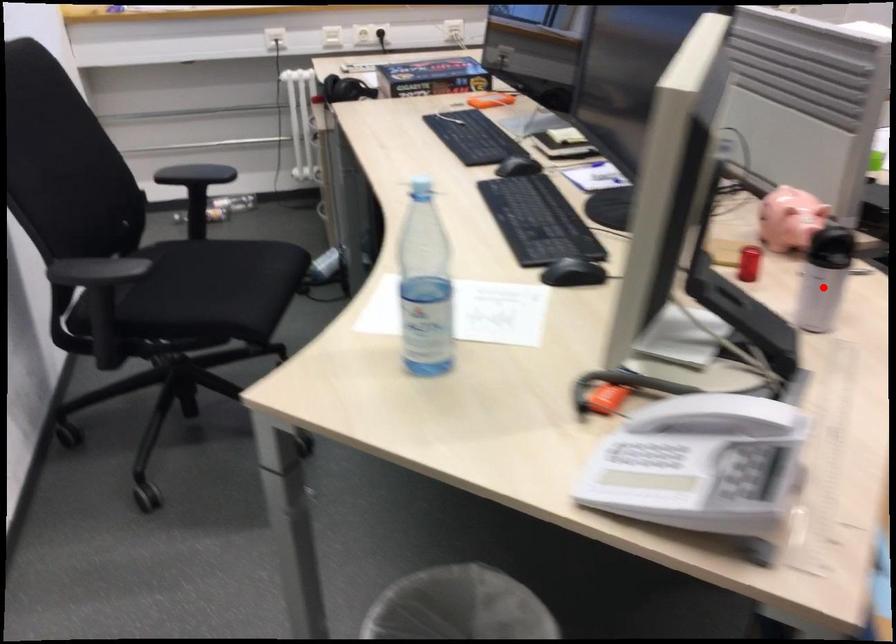
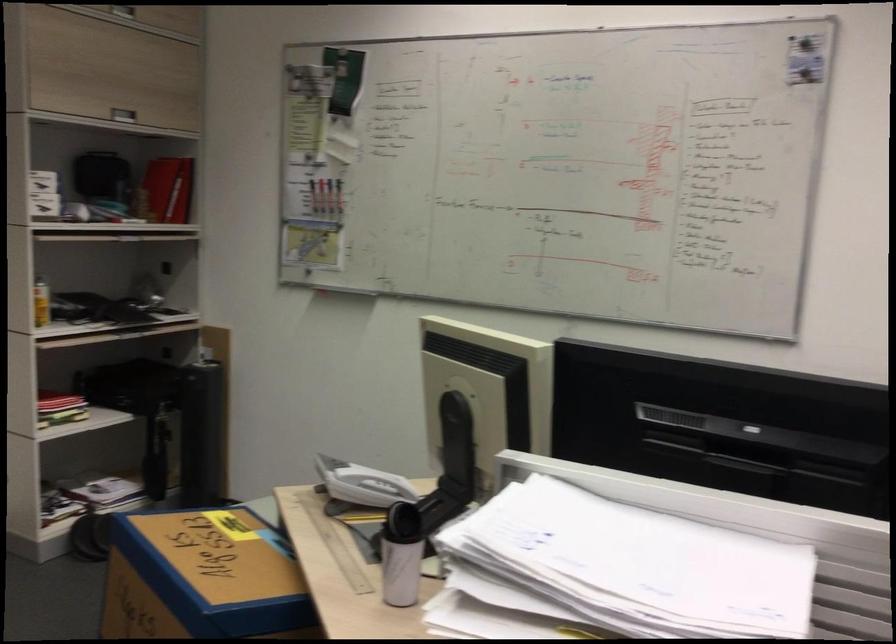
Find the pixel in the second image that matches the highlighted location in the first image.

(400, 570)